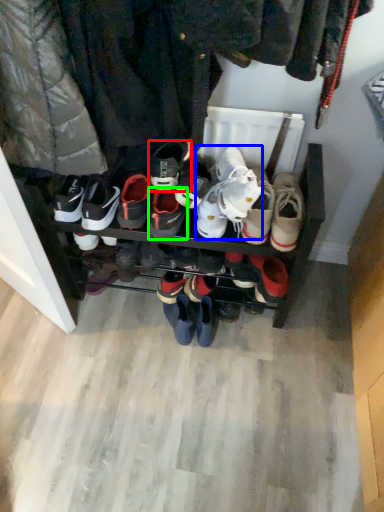
Question: Considering the real-world distances, which object is closest to footwear (highlighted by a red box)? footwear (highlighted by a blue box) or footwear (highlighted by a green box).

Choices:
 (A) footwear
 (B) footwear

Answer: (B)